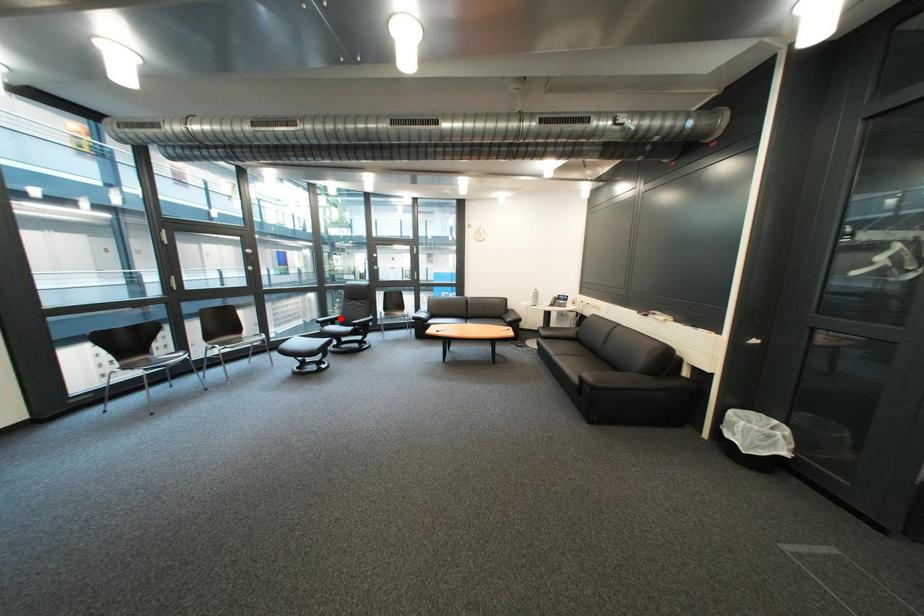
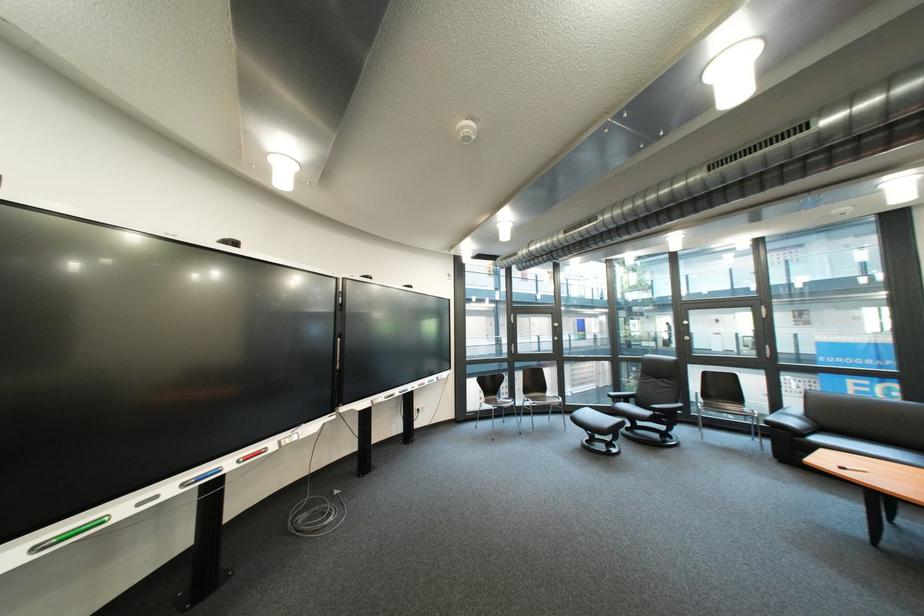
Question: I am providing you with two images of the same scene from different viewpoints. A red point is marked on the first image. Can you still see the location of the red point in image 2?

Choices:
 (A) Yes
 (B) No

Answer: (A)